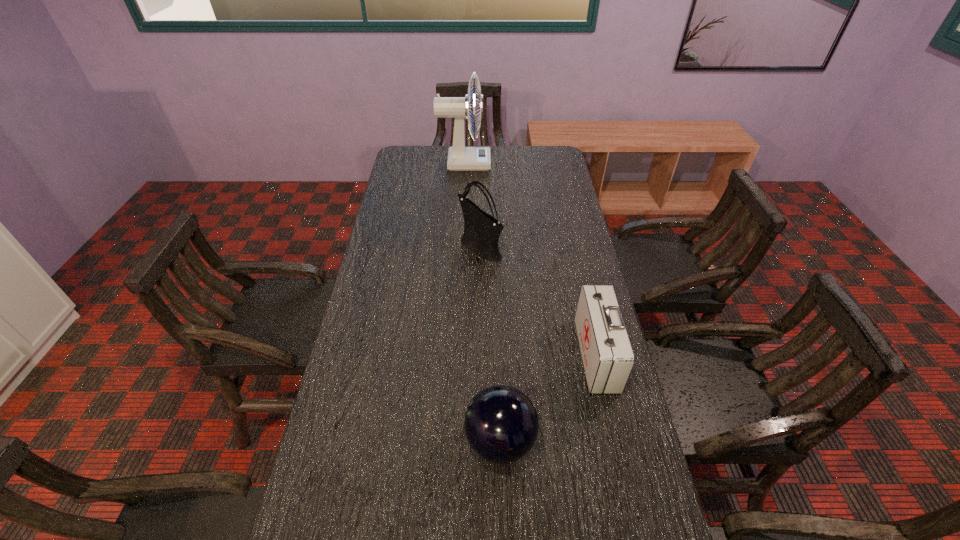
The width and height of the screenshot is (960, 540). In the image, there is a desktop. What are the coordinates of `free space at the far left corner` in the screenshot? It's located at (430, 152).

The height and width of the screenshot is (540, 960). Find the location of `vacant space that is in between the third nearest object and the second nearest object`. vacant space that is in between the third nearest object and the second nearest object is located at coordinates (538, 301).

This screenshot has width=960, height=540. Identify the location of vacant region between the shoulder bag and the second nearest object. (538, 301).

Where is `free space between the shoulder bag and the first-aid kit`? The width and height of the screenshot is (960, 540). free space between the shoulder bag and the first-aid kit is located at coordinates (538, 301).

Locate an element on the screen. The height and width of the screenshot is (540, 960). free space between the third shortest object and the rightmost object is located at coordinates (538, 301).

Where is `free space between the rightmost object and the bowling ball`? This screenshot has width=960, height=540. free space between the rightmost object and the bowling ball is located at coordinates (548, 398).

Point out which object is positioned as the third nearest to the farthest object. Please provide its 2D coordinates. Your answer should be formatted as a tuple, i.e. [(x, y)], where the tuple contains the x and y coordinates of a point satisfying the conditions above.

[(501, 424)]

Select which object is the closest to the tallest object. Please provide its 2D coordinates. Your answer should be formatted as a tuple, i.e. [(x, y)], where the tuple contains the x and y coordinates of a point satisfying the conditions above.

[(481, 233)]

What are the coordinates of `free location that satisfies the following two spatial constraints: 1. on the front-facing side of the third shortest object; 2. on the left side of the farthest object` in the screenshot? It's located at (460, 247).